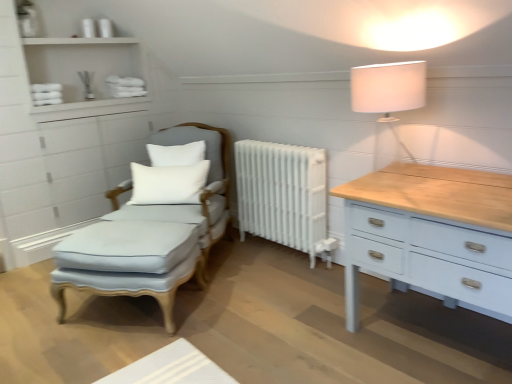
Question: Is white fabric lampshade at upper right not within white painted radiator at center?

Choices:
 (A) yes
 (B) no

Answer: (A)

Question: From the image's perspective, does white fabric lampshade at upper right appear lower than white painted radiator at center?

Choices:
 (A) yes
 (B) no

Answer: (B)

Question: Does white fabric lampshade at upper right appear on the right side of white painted radiator at center?

Choices:
 (A) yes
 (B) no

Answer: (A)

Question: Is white fabric lampshade at upper right bigger than white painted radiator at center?

Choices:
 (A) no
 (B) yes

Answer: (A)

Question: Can you see white fabric lampshade at upper right touching white painted radiator at center?

Choices:
 (A) no
 (B) yes

Answer: (A)

Question: From the image's perspective, relative to white matte pillow at center, positioned as the 2th pillow in bottom-to-top order, is white painted radiator at center above or below?

Choices:
 (A) above
 (B) below

Answer: (B)

Question: Is white painted radiator at center wider or thinner than white matte pillow at center, positioned as the 2th pillow in bottom-to-top order?

Choices:
 (A) thin
 (B) wide

Answer: (B)

Question: Relative to white matte pillow at center, positioned as the 2th pillow in bottom-to-top order, is white painted radiator at center in front or behind?

Choices:
 (A) front
 (B) behind

Answer: (A)

Question: Is white painted radiator at center inside or outside of white matte pillow at center, positioned as the 2th pillow in bottom-to-top order?

Choices:
 (A) inside
 (B) outside

Answer: (B)

Question: Considering the positions of point (37, 61) and point (396, 119), is point (37, 61) closer or farther from the camera than point (396, 119)?

Choices:
 (A) closer
 (B) farther

Answer: (B)

Question: From the image's perspective, is white matte shelves at upper left above or below white fabric lampshade at upper right?

Choices:
 (A) below
 (B) above

Answer: (B)

Question: Is white matte shelves at upper left situated inside white fabric lampshade at upper right or outside?

Choices:
 (A) outside
 (B) inside

Answer: (A)

Question: Visually, is white matte shelves at upper left positioned to the left or to the right of white fabric lampshade at upper right?

Choices:
 (A) left
 (B) right

Answer: (A)

Question: From a real-world perspective, is white fabric lampshade at upper right positioned above or below light blue fabric swivel chair at center-left?

Choices:
 (A) below
 (B) above

Answer: (B)

Question: Does point (381, 72) appear closer or farther from the camera than point (168, 211)?

Choices:
 (A) farther
 (B) closer

Answer: (B)